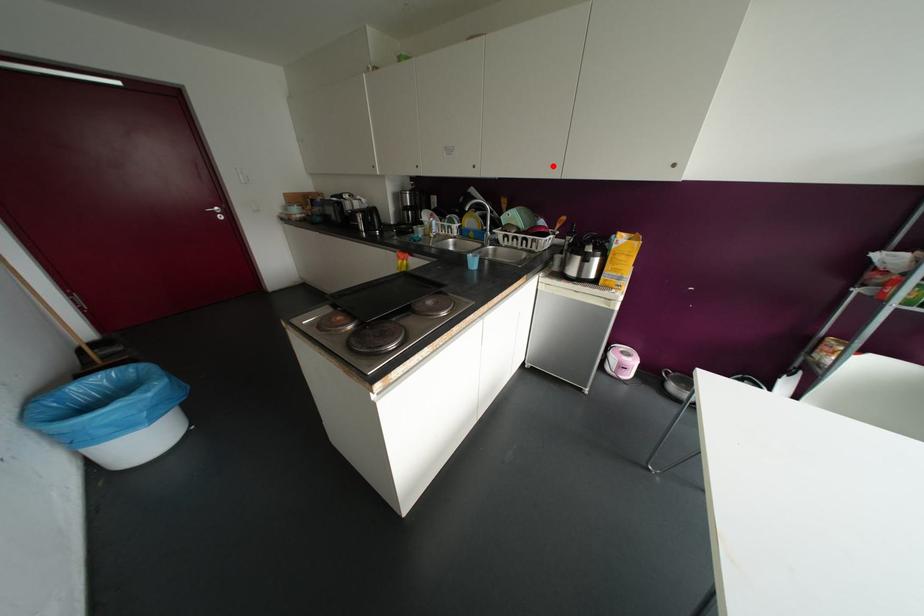
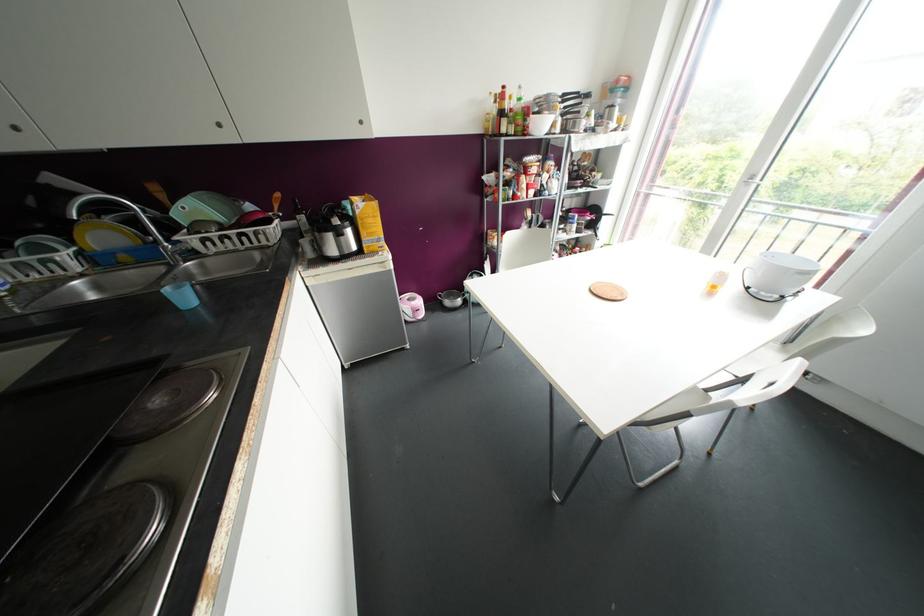
Locate, in the second image, the point that corresponds to the highlighted location in the first image.

(219, 124)